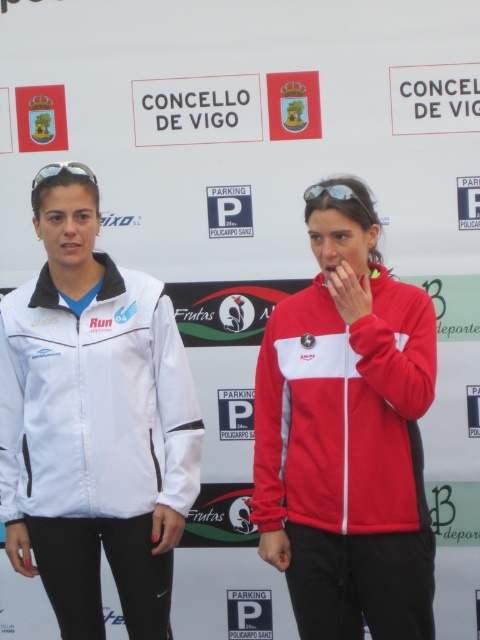
You are a photographer setting up for a group photo. You notice the red fleece jacket at center and the matte black sunglasses at center in the frame. Which object should you focus on first if you want to ensure the larger object is in sharp focus?

The red fleece jacket at center is larger in size than the matte black sunglasses at center, so you should focus on the red fleece jacket at center first to ensure it is in sharp focus.

You are a tailor who needs to determine which jacket between the white softshell jacket at left and the red fleece jacket at center is taller. Based on the scene, which one is taller?

The white softshell jacket at left has a greater height compared to the red fleece jacket at center, so the white softshell jacket at left is taller.

You are a photographer standing at the origin point of the image. You need to take a photo that includes both the point at (46,449) and the point at (308,300). Which point should you focus on first to ensure both are in the frame?

You should focus on point (46,449) first because it is in front of point (308,300), so adjusting the camera to include the closer point will naturally include the farther one.